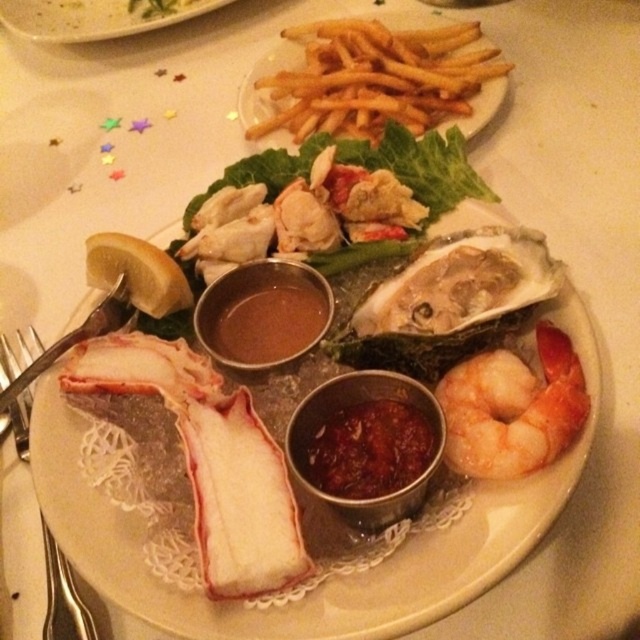
Which is below, white glossy plate at center or silver metallic fork at lower left?

silver metallic fork at lower left is lower down.

Between white glossy plate at center and silver metallic fork at lower left, which one has more height?

With more height is white glossy plate at center.

Where is `white glossy plate at center`? The width and height of the screenshot is (640, 640). white glossy plate at center is located at coordinates (429, 611).

You are a GUI agent. You are given a task and a screenshot of the screen. Output one action in this format:
    pyautogui.click(x=<x>, y=<y>)
    Task: Click on the white glossy plate at center
    The height and width of the screenshot is (640, 640).
    Given the screenshot: What is the action you would take?
    pyautogui.click(x=429, y=611)

Can you confirm if shiny silver oyster at center is shorter than white glossy plate at center?

Yes.

Who is shorter, shiny silver oyster at center or white glossy plate at center?

shiny silver oyster at center

At what (x,y) coordinates should I click in order to perform the action: click on shiny silver oyster at center. Please return your answer as a coordinate pair (x, y). The image size is (640, 640). Looking at the image, I should click on (449, 301).

Find the location of a particular element. The width and height of the screenshot is (640, 640). shiny silver oyster at center is located at coordinates (449, 301).

Does golden crispy fries at center have a lesser height compared to shiny silver oyster at center?

In fact, golden crispy fries at center may be taller than shiny silver oyster at center.

Measure the distance between golden crispy fries at center and camera.

The distance of golden crispy fries at center from camera is 33.47 inches.

Who is more forward, (397, 116) or (436, 380)?

Positioned in front is point (436, 380).

At what (x,y) coordinates should I click in order to perform the action: click on golden crispy fries at center. Please return your answer as a coordinate pair (x, y). Looking at the image, I should click on (376, 80).